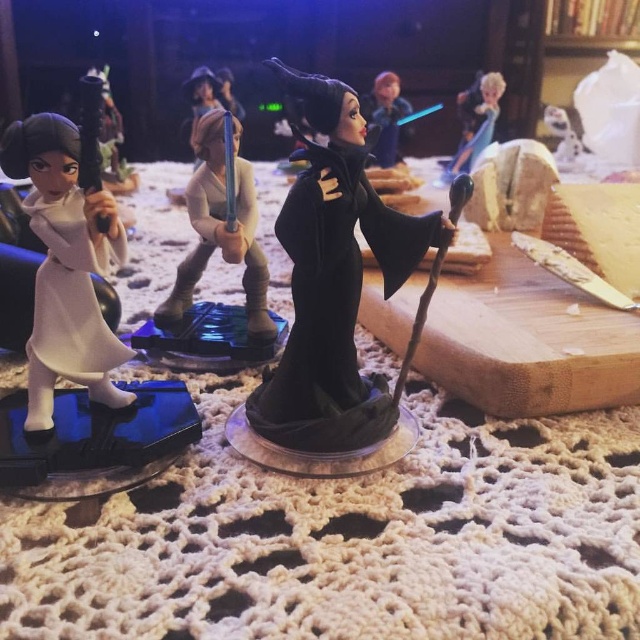
Does point (317, 205) come closer to viewer compared to point (234, 140)?

Yes, point (317, 205) is in front of point (234, 140).

Does black velvet figure at center have a lesser width compared to satin gold armor at center?

Incorrect, black velvet figure at center's width is not less than satin gold armor at center's.

Does point (362, 163) lie in front of point (232, 252)?

Yes, point (362, 163) is in front of point (232, 252).

Locate an element on the screen. The height and width of the screenshot is (640, 640). black velvet figure at center is located at coordinates (333, 282).

Does satin gold armor at center appear under smooth plastic figure at upper center?

Indeed, satin gold armor at center is positioned under smooth plastic figure at upper center.

Who is more forward, (200, 152) or (385, 131)?

Point (200, 152)

This screenshot has height=640, width=640. I want to click on satin gold armor at center, so click(x=220, y=227).

Can you confirm if white glossy figure at left is wider than satin gold armor at center?

No.

Between point (58, 237) and point (220, 173), which one is positioned behind?

Positioned behind is point (220, 173).

Image resolution: width=640 pixels, height=640 pixels. Describe the element at coordinates (65, 266) in the screenshot. I see `white glossy figure at left` at that location.

Locate an element on the screen. white glossy figure at left is located at coordinates (65, 266).